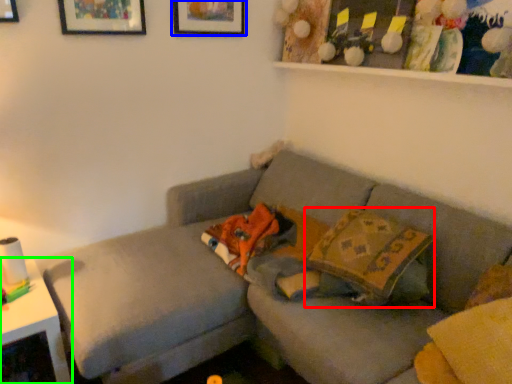
Question: Which is farther away from throw pillow (highlighted by a red box)? picture frame (highlighted by a blue box) or table (highlighted by a green box)?

Choices:
 (A) picture frame
 (B) table

Answer: (A)